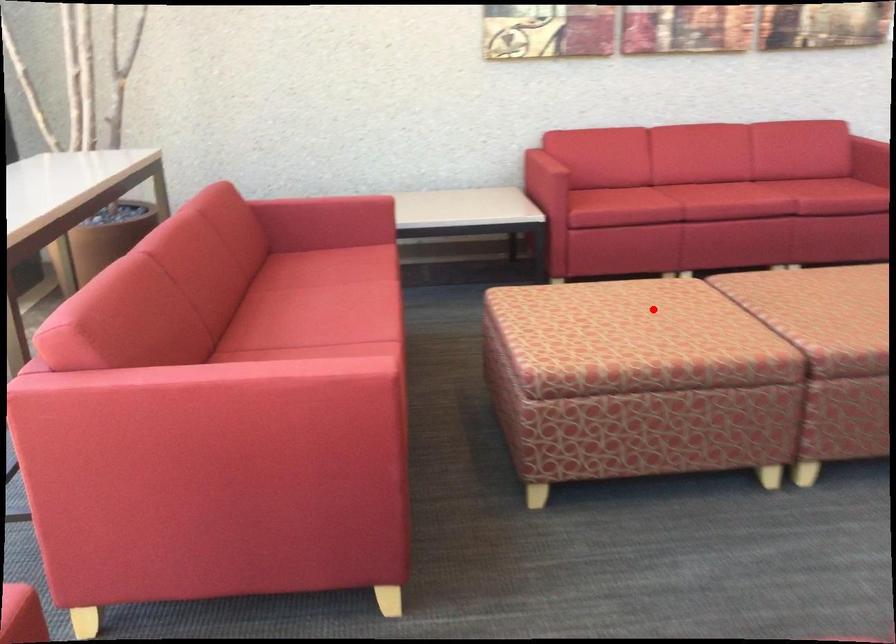
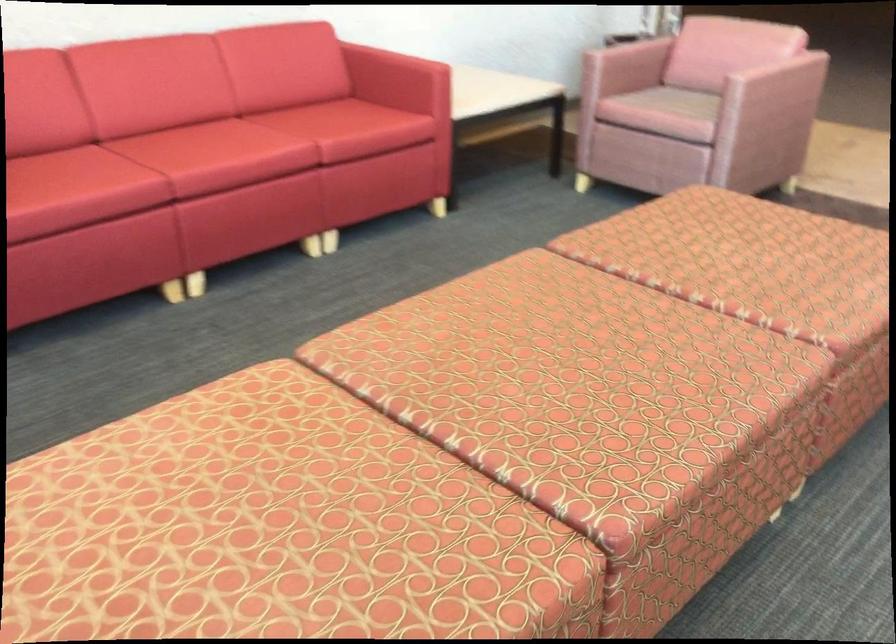
In the second image, find the point that corresponds to the highlighted location in the first image.

(250, 522)